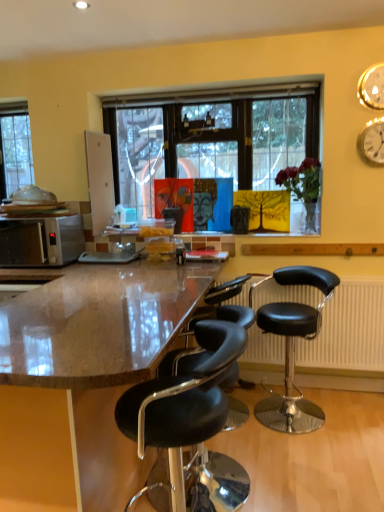
Question: From a real-world perspective, is clear glass window at left above or below matte orange portrait at center, placed as the 1th person when sorted from left to right?

Choices:
 (A) above
 (B) below

Answer: (A)

Question: Relative to matte orange portrait at center, arranged as the second person when viewed from the right, is clear glass window at left in front or behind?

Choices:
 (A) front
 (B) behind

Answer: (B)

Question: Estimate the real-world distances between objects in this image. Which object is farther from the brown polished granite countertop at center?

Choices:
 (A) clear glass window at left
 (B) gold metallic clock at upper right, which ranks as the first clock in bottom-to-top order
 (C) gold metallic clock at upper right, the 2th clock in the bottom-to-top sequence
 (D) translucent glass vase at upper center
 (E) blue textured canvas at center, positioned as the second person in left-to-right order

Answer: (C)

Question: Which object is the farthest from the clear glass window at left?

Choices:
 (A) translucent glass vase at upper center
 (B) blue textured canvas at center, which is the 1th person in right-to-left order
 (C) black plastic radiator at lower right
 (D) matte orange portrait at center, arranged as the second person when viewed from the right
 (E) satin silver microwave at left

Answer: (C)